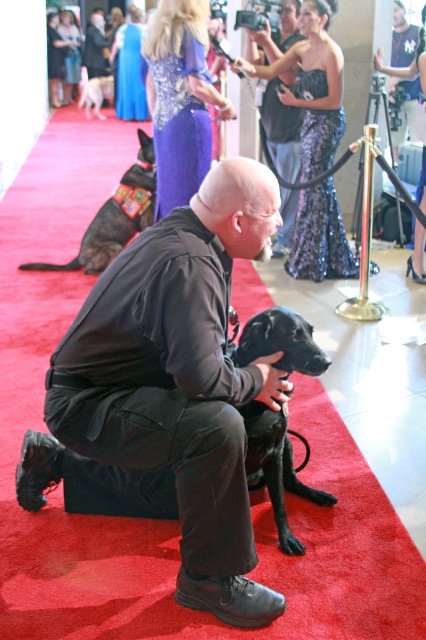
You are a photographer at the event and want to capture a photo that includes both the black matte dog at center and the white fur dog at upper left. The camera you are using has a maximum focus range of 30 feet. Can you fit both dogs in the same photo without moving the camera?

The black matte dog at center and white fur dog at upper left are 35.36 feet apart, which exceeds the camera maximum focus range of 30 feet. Therefore, you cannot fit both dogs in the same photo without moving the camera.

You are a photographer at the event and need to capture a photo that includes both the black matte dog at center and the white fur dog at upper left. Which dog should you position closer to the camera to ensure both are clearly visible in the frame?

Since the black matte dog at center is smaller than the white fur dog at upper left, you should position the black matte dog at center closer to the camera to ensure both are clearly visible in the frame.

You are a photographer at this event. You want to take a photo of the black matte jacket at center and the black matte dog at center together in the frame. Given that your camera has a minimum focus distance of 12 inches, will you need to step back to ensure both are in focus?

The distance between the black matte jacket at center and the black matte dog at center is 11.41 inches. Since this is less than the camera minimum focus distance of 12 inches, you will need to step back to ensure both are in focus.